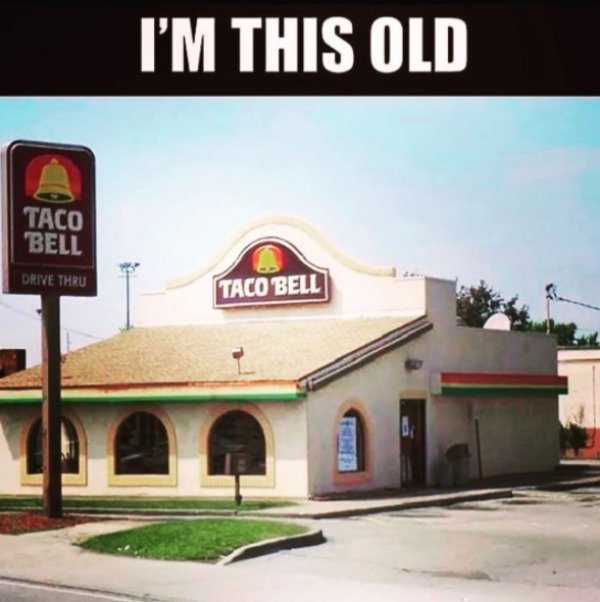
This screenshot has width=600, height=602. Identify the location of window. (164, 438).